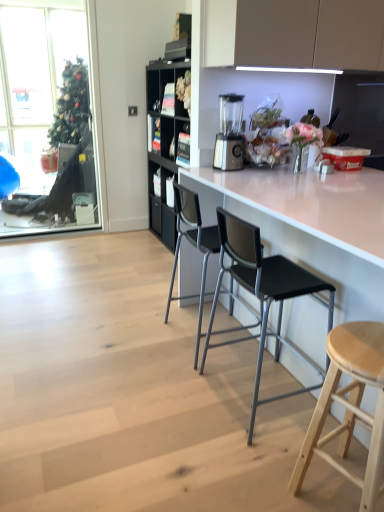
Find the location of a particular element. empty space that is in between black plastic chair at center, acting as the 1th chair starting from the front, and black plastic chair at center, which is the 2th chair from front to back is located at coordinates (220, 365).